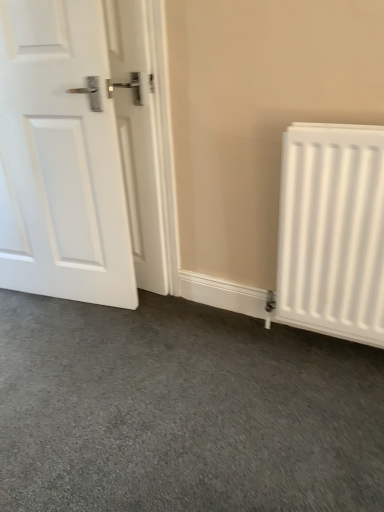
Question: Is white matte door at left situated inside white matte radiator at right or outside?

Choices:
 (A) inside
 (B) outside

Answer: (B)

Question: From the image's perspective, relative to white matte radiator at right, is white matte door at left above or below?

Choices:
 (A) below
 (B) above

Answer: (B)

Question: In the image, is white matte door at left on the left side or the right side of white matte radiator at right?

Choices:
 (A) right
 (B) left

Answer: (B)

Question: In terms of size, does white matte radiator at right appear bigger or smaller than white matte door at left?

Choices:
 (A) small
 (B) big

Answer: (A)

Question: From the image's perspective, is white matte radiator at right positioned above or below white matte door at left?

Choices:
 (A) above
 (B) below

Answer: (B)

Question: Is white matte radiator at right wider or thinner than white matte door at left?

Choices:
 (A) thin
 (B) wide

Answer: (A)

Question: Is white matte radiator at right to the left or to the right of white matte door at left in the image?

Choices:
 (A) left
 (B) right

Answer: (B)